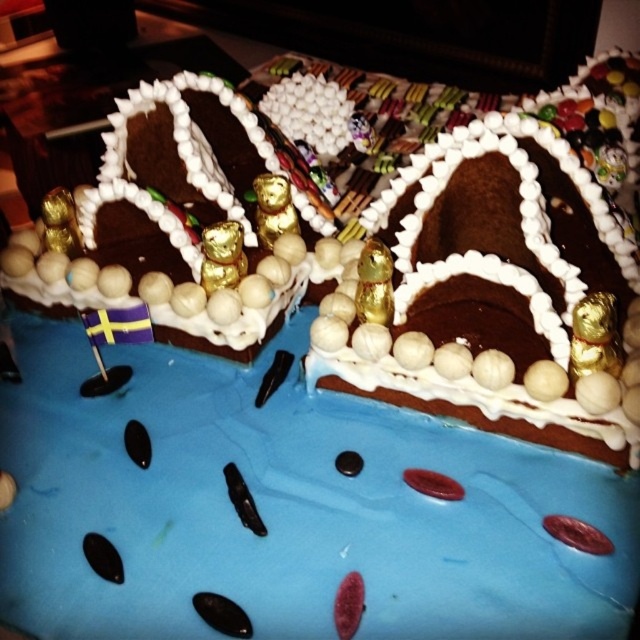
Measure the distance between chocolate matte cake at center and chocolate matte gingerbread house at left.

chocolate matte cake at center and chocolate matte gingerbread house at left are 22.57 centimeters apart from each other.

Is chocolate matte cake at center positioned in front of chocolate matte gingerbread house at left?

That is True.

The width and height of the screenshot is (640, 640). I want to click on chocolate matte cake at center, so click(493, 291).

Where is `chocolate matte cake at center`? This screenshot has height=640, width=640. chocolate matte cake at center is located at coordinates (493, 291).